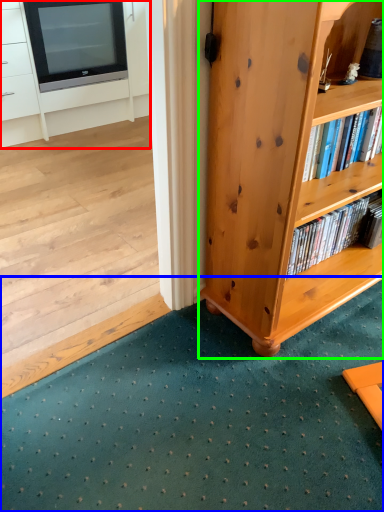
Question: Estimate the real-world distances between objects in this image. Which object is closer to cabinetry (highlighted by a red box), doormat (highlighted by a blue box) or bookcase (highlighted by a green box)?

Choices:
 (A) doormat
 (B) bookcase

Answer: (B)